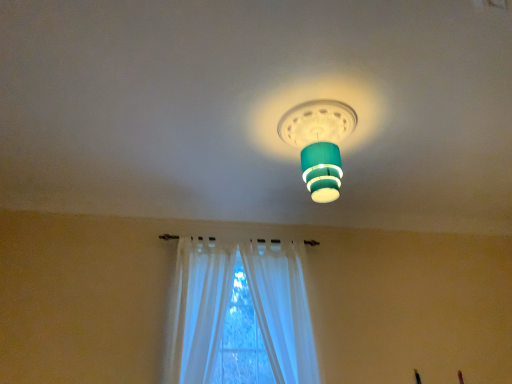
Question: From the image's perspective, is white sheer curtain at lower center, the 2th curtain in the right-to-left sequence, below white sheer curtain at center, which is counted as the first curtain, starting from the right?

Choices:
 (A) no
 (B) yes

Answer: (A)

Question: Is white sheer curtain at lower center, which ranks as the first curtain in left-to-right order, positioned behind white sheer curtain at center, which is the 2th curtain from left to right?

Choices:
 (A) yes
 (B) no

Answer: (B)

Question: Considering the relative sizes of white sheer curtain at lower center, the 2th curtain in the right-to-left sequence, and white sheer curtain at center, which is counted as the first curtain, starting from the right, in the image provided, is white sheer curtain at lower center, the 2th curtain in the right-to-left sequence, bigger than white sheer curtain at center, which is counted as the first curtain, starting from the right,?

Choices:
 (A) no
 (B) yes

Answer: (B)

Question: From a real-world perspective, is white sheer curtain at lower center, which ranks as the first curtain in left-to-right order, positioned over white sheer curtain at center, which is counted as the first curtain, starting from the right, based on gravity?

Choices:
 (A) no
 (B) yes

Answer: (B)

Question: Does white sheer curtain at lower center, the 2th curtain in the right-to-left sequence, have a greater height compared to white sheer curtain at center, which is the 2th curtain from left to right?

Choices:
 (A) no
 (B) yes

Answer: (A)

Question: From the image's perspective, is white sheer curtain at center, which is counted as the first curtain, starting from the right, positioned above or below white sheer curtain at lower center, which ranks as the first curtain in left-to-right order?

Choices:
 (A) below
 (B) above

Answer: (A)

Question: Considering the positions of point [270, 329] and point [204, 241], is point [270, 329] closer or farther from the camera than point [204, 241]?

Choices:
 (A) farther
 (B) closer

Answer: (B)

Question: From a real-world perspective, relative to white sheer curtain at lower center, which ranks as the first curtain in left-to-right order, is white sheer curtain at center, which is counted as the first curtain, starting from the right, vertically above or below?

Choices:
 (A) above
 (B) below

Answer: (B)

Question: Is white sheer curtain at center, which is counted as the first curtain, starting from the right, wider or thinner than white sheer curtain at lower center, which ranks as the first curtain in left-to-right order?

Choices:
 (A) thin
 (B) wide

Answer: (A)

Question: Is teal matte lampshade at center bigger or smaller than white sheer curtain at center, which is the 2th curtain from left to right?

Choices:
 (A) small
 (B) big

Answer: (A)

Question: From the image's perspective, is teal matte lampshade at center located above or below white sheer curtain at center, which is the 2th curtain from left to right?

Choices:
 (A) below
 (B) above

Answer: (B)

Question: In the image, is teal matte lampshade at center on the left side or the right side of white sheer curtain at center, which is the 2th curtain from left to right?

Choices:
 (A) right
 (B) left

Answer: (A)

Question: From a real-world perspective, is teal matte lampshade at center above or below white sheer curtain at center, which is counted as the first curtain, starting from the right?

Choices:
 (A) below
 (B) above

Answer: (B)

Question: Is white sheer curtain at lower center, which ranks as the first curtain in left-to-right order, bigger or smaller than white sheer curtain at center, which is the 2th curtain from left to right?

Choices:
 (A) small
 (B) big

Answer: (B)

Question: Considering their positions, is white sheer curtain at lower center, the 2th curtain in the right-to-left sequence, located in front of or behind white sheer curtain at center, which is counted as the first curtain, starting from the right?

Choices:
 (A) behind
 (B) front

Answer: (B)